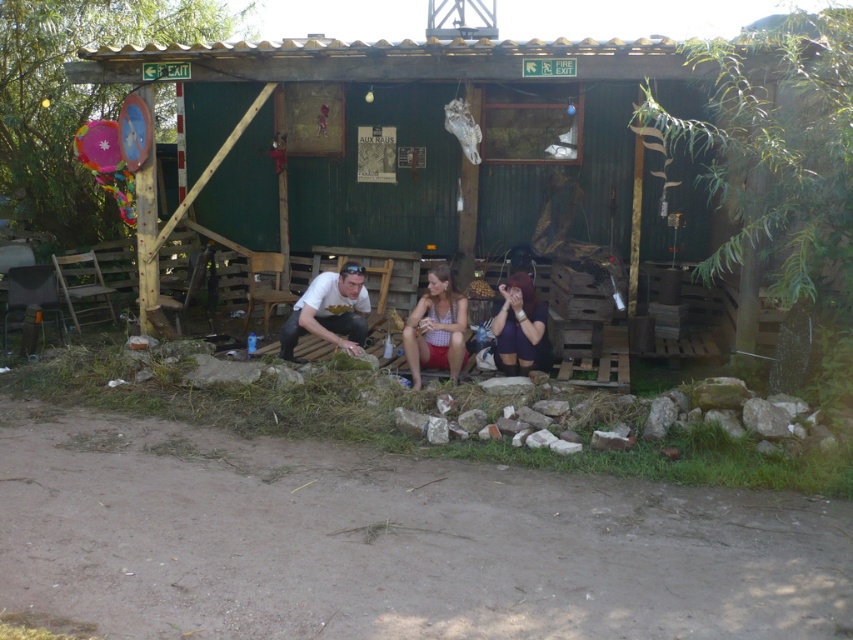
Can you confirm if white matte shirt at lower center is shorter than matte purple shorts at lower center?

Correct, white matte shirt at lower center is not as tall as matte purple shorts at lower center.

The width and height of the screenshot is (853, 640). Describe the element at coordinates (329, 310) in the screenshot. I see `white matte shirt at lower center` at that location.

Where is `white matte shirt at lower center`? Image resolution: width=853 pixels, height=640 pixels. white matte shirt at lower center is located at coordinates (329, 310).

Looking at this image, does green wooden cabin at center have a greater height compared to matte purple shorts at lower center?

Incorrect, green wooden cabin at center's height is not larger of matte purple shorts at lower center's.

In the scene shown: Is green wooden cabin at center shorter than matte purple shorts at lower center?

Yes.

Describe the element at coordinates (523, 140) in the screenshot. Image resolution: width=853 pixels, height=640 pixels. I see `green wooden cabin at center` at that location.

The width and height of the screenshot is (853, 640). Identify the location of green wooden cabin at center. (523, 140).

I want to click on matte white tank top at center, so click(x=436, y=328).

Identify the location of matte white tank top at center. The height and width of the screenshot is (640, 853). (436, 328).